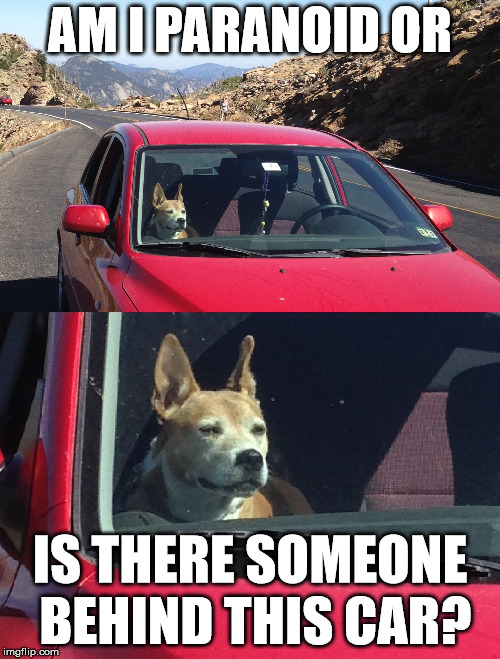
The image size is (500, 659). In order to click on hanging items in this screenshot , I will do `click(265, 200)`.